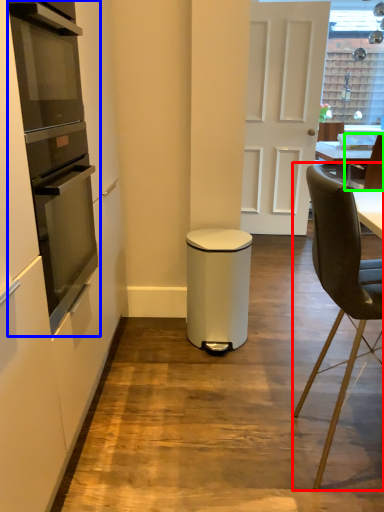
Question: Considering the real-world distances, which object is closest to chair (highlighted by a red box)? kitchen appliance (highlighted by a blue box) or chair (highlighted by a green box).

Choices:
 (A) kitchen appliance
 (B) chair

Answer: (A)